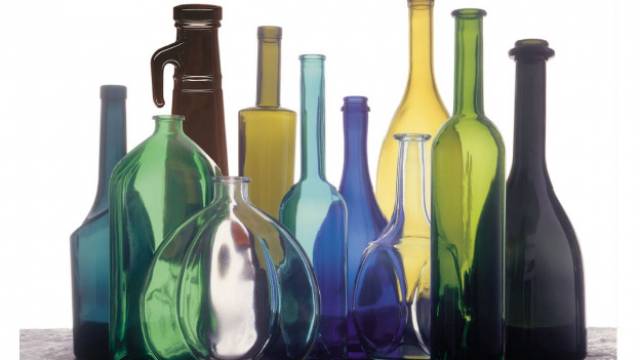
Locate an element on the screen. The image size is (640, 360). five most left glass bottles is located at coordinates point(268,131), point(248,245), point(209,126), point(180,189), point(102,226).